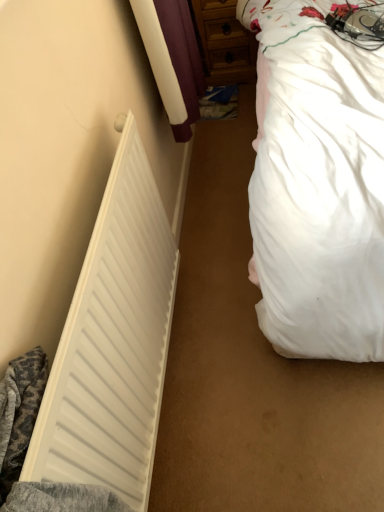
Identify the location of white soft bed at right. (318, 181).

Identify the location of dresser below the white matte radiator at left (from a real-world perspective). (224, 42).

Which is more to the right, white matte radiator at left or wooden dresser at upper center?

Positioned to the right is wooden dresser at upper center.

Considering the sizes of objects white matte radiator at left and wooden dresser at upper center in the image provided, who is wider, white matte radiator at left or wooden dresser at upper center?

wooden dresser at upper center.

Considering the sizes of white matte radiator at left and white soft bed at right in the image, is white matte radiator at left bigger or smaller than white soft bed at right?

Considering their sizes, white matte radiator at left takes up less space than white soft bed at right.

Is white matte radiator at left oriented away from white soft bed at right?

white matte radiator at left is not turned away from white soft bed at right.

Considering their positions, is white matte radiator at left located in front of or behind white soft bed at right?

Clearly, white matte radiator at left is behind white soft bed at right.

In the scene shown: How many degrees apart are the facing directions of white matte radiator at left and white soft bed at right?

The angular difference between white matte radiator at left and white soft bed at right is 89.1 degrees.

What's the angular difference between wooden dresser at upper center and white soft bed at right's facing directions?

They differ by 1.21 degrees in their facing directions.

Is point (225, 46) in front of point (334, 36)?

No, (225, 46) is behind (334, 36).

How distant is wooden dresser at upper center from white soft bed at right?

wooden dresser at upper center and white soft bed at right are 3.61 feet apart.

From a real-world perspective, is wooden dresser at upper center on top of white soft bed at right?

No.

Is wooden dresser at upper center completely or partially inside white soft bed at right?

Actually, wooden dresser at upper center is outside white soft bed at right.

Is point (357, 90) less distant than point (229, 6)?

Yes, it is.

Considering their positions, is white soft bed at right located in front of or behind wooden dresser at upper center?

white soft bed at right is in front of wooden dresser at upper center.

From a real-world perspective, is wooden dresser at upper center positioned over white matte radiator at left based on gravity?

No, from a real-world perspective, wooden dresser at upper center is not above white matte radiator at left.

Considering the sizes of wooden dresser at upper center and white matte radiator at left in the image, is wooden dresser at upper center taller or shorter than white matte radiator at left?

Clearly, wooden dresser at upper center is shorter compared to white matte radiator at left.

How much distance is there between wooden dresser at upper center and white matte radiator at left?

wooden dresser at upper center is 5.13 feet away from white matte radiator at left.

Is wooden dresser at upper center with white matte radiator at left?

wooden dresser at upper center and white matte radiator at left are not in contact.

Is white soft bed at right not close to white matte radiator at left?

No, there isn't a large distance between white soft bed at right and white matte radiator at left.

From a real-world perspective, is white soft bed at right positioned over white matte radiator at left based on gravity?

Yes, from a real-world perspective, white soft bed at right is on top of white matte radiator at left.

Which object is positioned more to the right, white soft bed at right or white matte radiator at left?

Positioned to the right is white soft bed at right.

Is white soft bed at right looking in the opposite direction of white matte radiator at left?

No, white soft bed at right is not facing away from white matte radiator at left.

Where is `radiator below the wooden dresser at upper center (from the image's perspective)`? radiator below the wooden dresser at upper center (from the image's perspective) is located at coordinates (113, 343).

The height and width of the screenshot is (512, 384). Find the location of `bed that appears in front of the white matte radiator at left`. bed that appears in front of the white matte radiator at left is located at coordinates (318, 181).

Estimate the real-world distances between objects in this image. Which object is closer to wooden dresser at upper center, white soft bed at right or white matte radiator at left?

Based on the image, white soft bed at right appears to be nearer to wooden dresser at upper center.

Looking at this image, when comparing their distances from white soft bed at right, does white matte radiator at left or wooden dresser at upper center seem closer?

Among the two, white matte radiator at left is located nearer to white soft bed at right.

Consider the image. Estimate the real-world distances between objects in this image. Which object is further from white soft bed at right, wooden dresser at upper center or white matte radiator at left?

wooden dresser at upper center is further to white soft bed at right.

Looking at the image, which one is located closer to white matte radiator at left, wooden dresser at upper center or white soft bed at right?

Based on the image, white soft bed at right appears to be nearer to white matte radiator at left.

When comparing their distances from wooden dresser at upper center, does white matte radiator at left or white soft bed at right seem closer?

white soft bed at right.

Based on their spatial positions, is white soft bed at right or wooden dresser at upper center closer to white matte radiator at left?

The object closer to white matte radiator at left is white soft bed at right.

The width and height of the screenshot is (384, 512). Find the location of `radiator between white soft bed at right and wooden dresser at upper center in the front-back direction`. radiator between white soft bed at right and wooden dresser at upper center in the front-back direction is located at coordinates (113, 343).